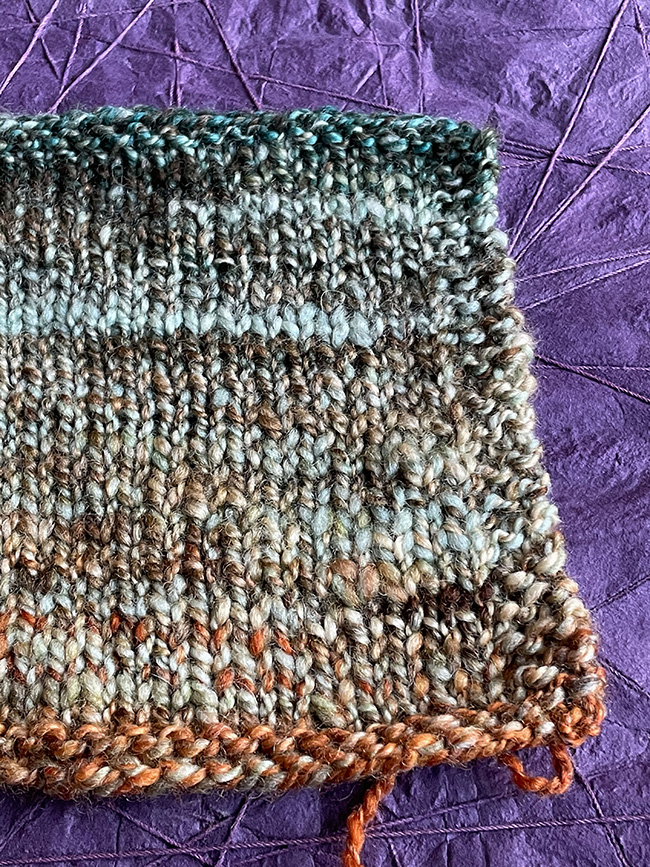
Image resolution: width=650 pixels, height=867 pixels. Identify the location of braided rug. (235, 525).